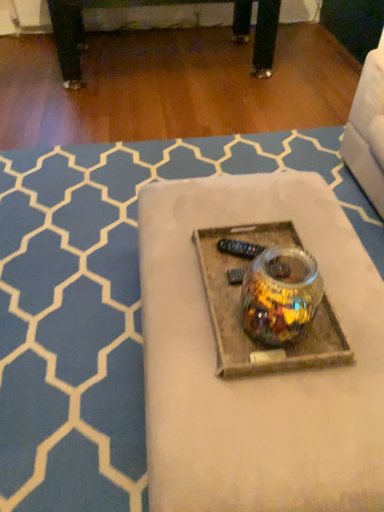
You are a GUI agent. You are given a task and a screenshot of the screen. Output one action in this format:
    pyautogui.click(x=<x>, y=<y>)
    Task: Click on the free space behind translucent glass jar at center
    This screenshot has width=384, height=512.
    Given the screenshot: What is the action you would take?
    pyautogui.click(x=253, y=263)